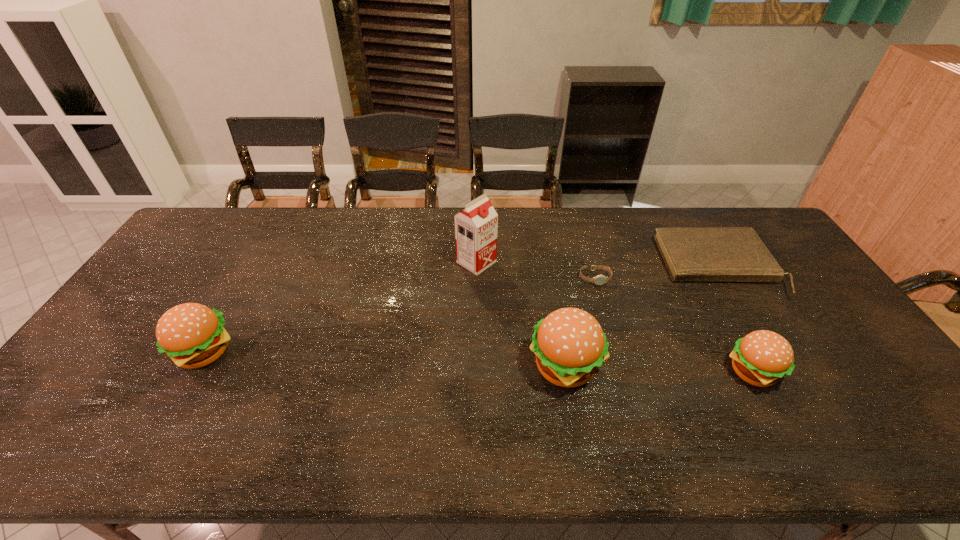
At what (x,y) coordinates should I click in order to perform the action: click on vacant space located on the back of the second hamburger from right to left. Please return your answer as a coordinate pair (x, y). This screenshot has height=540, width=960. Looking at the image, I should click on (546, 251).

I want to click on blank space located 0.290m on the back of the shortest hamburger, so click(702, 277).

Identify the location of vacant space positioned on the face of the watch. (x=617, y=360).

Where is `vacant space located 0.400m on the front of the fifth object from right to left`? The image size is (960, 540). vacant space located 0.400m on the front of the fifth object from right to left is located at coordinates (475, 384).

You are a GUI agent. You are given a task and a screenshot of the screen. Output one action in this format:
    pyautogui.click(x=<x>, y=<y>)
    Task: Click on the vacant space situated on the spine side of the paperback book
    
    Given the screenshot: What is the action you would take?
    pyautogui.click(x=760, y=339)

I want to click on object that is at the far edge, so click(691, 254).

Where is `object located in the right edge section of the desktop`? object located in the right edge section of the desktop is located at coordinates (691, 254).

The image size is (960, 540). What are the coordinates of `object that is at the far right corner` in the screenshot? It's located at (691, 254).

In the image, there is a desktop. Find the location of `free space at the far edge`. free space at the far edge is located at coordinates (558, 211).

In the image, there is a desktop. In order to click on vacant space at the near edge in this screenshot , I will do click(469, 390).